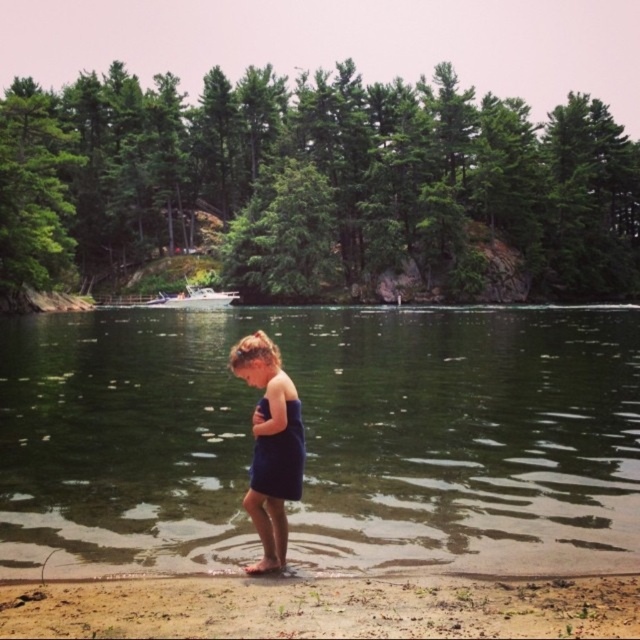
You are a photographer trying to capture the child in the scene. To ensure both the sandy shore at lower center and the blue fabric dress at center are visible in the frame, which direction should you position yourself relative to the child?

You should position yourself to the left of the child so that the sandy shore at lower center and the blue fabric dress at center are both visible in the frame, as the sandy shore at lower center is to the right of the blue fabric dress at center.

You are a parent supervising a child at the lakeside. The child is standing on the sandy shore at lower center. You want to ensure they can safely reach the clear water at lower center. Based on the distance between them, is the water within a safe distance for a child to walk to without assistance?

The clear water at lower center is 12.76 meters away from the sandy shore at lower center. Since this distance may be too far for a young child to walk safely without assistance, it is recommended to accompany them to ensure their safety.